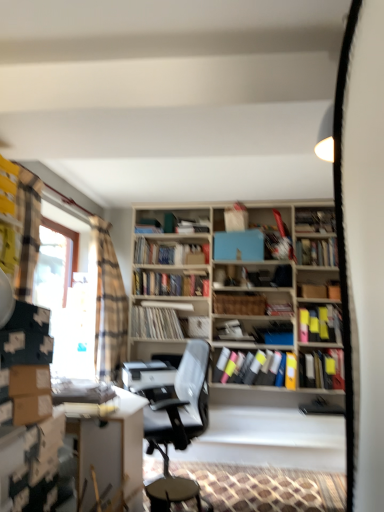
Question: Is hardcover books at center, positioned as the 3th book in top-to-bottom order, further to the viewer compared to matte black book at center, marked as the 6th book in a bottom-to-top arrangement?

Choices:
 (A) yes
 (B) no

Answer: (A)

Question: Is hardcover books at center, positioned as the 3th book in top-to-bottom order, to the right of matte black book at center, which is counted as the 5th book, starting from the top, from the viewer's perspective?

Choices:
 (A) yes
 (B) no

Answer: (B)

Question: Can you confirm if hardcover books at center, which ranks as the 8th book in bottom-to-top order, is smaller than matte black book at center, marked as the 6th book in a bottom-to-top arrangement?

Choices:
 (A) yes
 (B) no

Answer: (B)

Question: Does hardcover books at center, which ranks as the 8th book in bottom-to-top order, have a greater height compared to matte black book at center, marked as the 6th book in a bottom-to-top arrangement?

Choices:
 (A) yes
 (B) no

Answer: (A)

Question: Can you confirm if hardcover books at center, which ranks as the 8th book in bottom-to-top order, is wider than matte black book at center, marked as the 6th book in a bottom-to-top arrangement?

Choices:
 (A) yes
 (B) no

Answer: (A)

Question: Would you consider hardcover books at center, which ranks as the 8th book in bottom-to-top order, to be distant from matte black book at center, which is counted as the 5th book, starting from the top?

Choices:
 (A) no
 (B) yes

Answer: (B)

Question: Is gray fabric office chair at center taller than matte black book at right, arranged as the 8th book when viewed from the top?

Choices:
 (A) no
 (B) yes

Answer: (B)

Question: From the image's perspective, is gray fabric office chair at center under matte black book at right, which ranks as the third book in bottom-to-top order?

Choices:
 (A) yes
 (B) no

Answer: (A)

Question: Can matte black book at right, which ranks as the third book in bottom-to-top order, be found inside gray fabric office chair at center?

Choices:
 (A) yes
 (B) no

Answer: (B)

Question: Can you confirm if gray fabric office chair at center is wider than matte black book at right, which ranks as the third book in bottom-to-top order?

Choices:
 (A) yes
 (B) no

Answer: (A)

Question: From a real-world perspective, does gray fabric office chair at center sit lower than matte black book at right, which ranks as the third book in bottom-to-top order?

Choices:
 (A) yes
 (B) no

Answer: (A)

Question: Is gray fabric office chair at center oriented away from matte black book at right, which ranks as the third book in bottom-to-top order?

Choices:
 (A) no
 (B) yes

Answer: (B)

Question: Can you see matte plastic books at center, which ranks as the second book in bottom-to-top order, touching wooden bar stool at center?

Choices:
 (A) yes
 (B) no

Answer: (B)